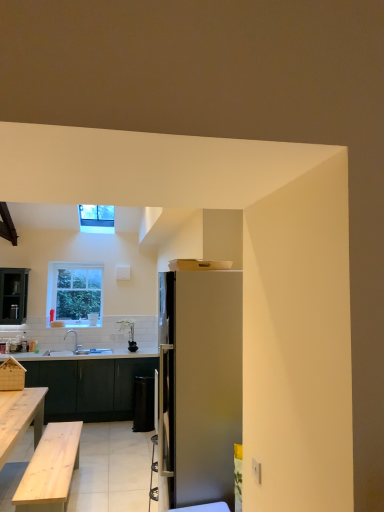
Question: Visually, is white glossy coffee cup at center positioned to the left or to the right of satin silver refrigerator at center?

Choices:
 (A) right
 (B) left

Answer: (B)

Question: In terms of width, does white glossy coffee cup at center look wider or thinner when compared to satin silver refrigerator at center?

Choices:
 (A) thin
 (B) wide

Answer: (A)

Question: Which of these objects is positioned farthest from the clear glass window at upper left, placed as the 2th window when sorted from front to back?

Choices:
 (A) white glossy sink at lower left
 (B) clear glass window at upper center, which is the second window in bottom-to-top order
 (C) satin silver refrigerator at center
 (D) black matte trash bin/can at center
 (E) white glossy coffee cup at center

Answer: (C)

Question: Which is nearer to the natural wood bench at left?

Choices:
 (A) wooden table at lower left
 (B) clear glass window at upper center, which is the second window in bottom-to-top order
 (C) clear glass window at upper left, positioned as the second window in top-to-bottom order
 (D) white glossy sink at lower left
 (E) white glossy coffee cup at center

Answer: (A)